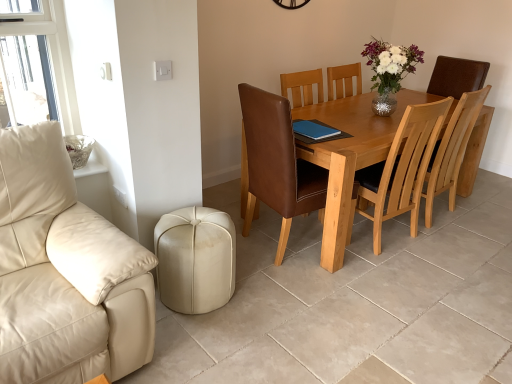
Question: From the image's perspective, relative to shiny silver vase at upper center, is beige leather ottoman at lower left above or below?

Choices:
 (A) above
 (B) below

Answer: (B)

Question: Is point (176, 246) closer or farther from the camera than point (382, 87)?

Choices:
 (A) farther
 (B) closer

Answer: (B)

Question: Which object is the farthest from the brown leather chair at center, the 2th chair positioned from the right?

Choices:
 (A) light brown wooden table at center
 (B) shiny silver vase at upper center
 (C) blue leather pad at center
 (D) beige leather ottoman at lower left
 (E) light brown wood chair at center, acting as the 1th chair starting from the right

Answer: (E)

Question: Which of these objects is positioned farthest from the blue leather pad at center?

Choices:
 (A) light brown wooden table at center
 (B) beige leather ottoman at lower left
 (C) shiny silver vase at upper center
 (D) brown leather chair at center, the first chair positioned from the left
 (E) light brown wood chair at center, acting as the 1th chair starting from the right

Answer: (E)